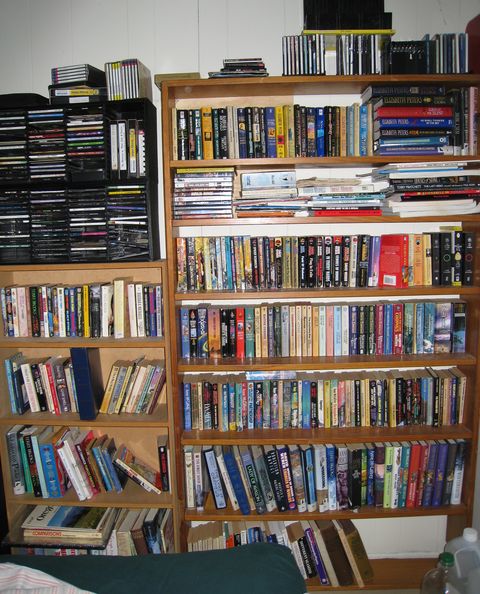
Identify the location of furnishings. pyautogui.click(x=83, y=412), pyautogui.click(x=278, y=400), pyautogui.click(x=237, y=565), pyautogui.click(x=98, y=157), pyautogui.click(x=108, y=206).